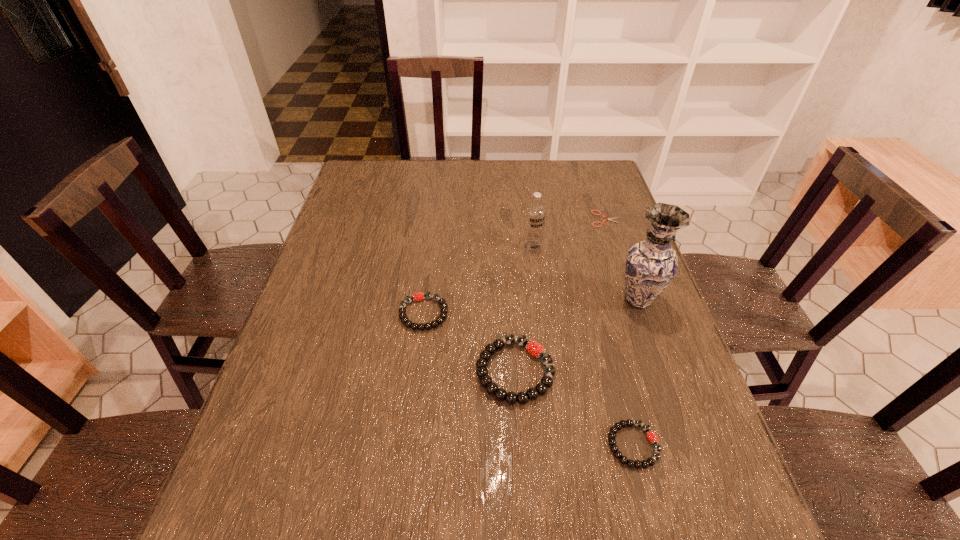
I want to click on the fourth closest object to the second bracelet from right to left, so click(535, 213).

The width and height of the screenshot is (960, 540). I want to click on bracelet that is the closest to the leftmost object, so click(534, 348).

You are a GUI agent. You are given a task and a screenshot of the screen. Output one action in this format:
    pyautogui.click(x=<x>, y=<y>)
    Task: Click on the second closest bracelet to the leftmost bracelet
    This screenshot has height=540, width=960.
    Given the screenshot: What is the action you would take?
    pyautogui.click(x=652, y=437)

Identify the location of free space in the image that satisfies the following two spatial constraints: 1. on the back side of the farthest object; 2. on the left side of the leftmost bracelet. (435, 219).

Where is `free location that satisfies the following two spatial constraints: 1. on the back side of the shortest object; 2. on the right side of the leftmost bracelet`? The width and height of the screenshot is (960, 540). free location that satisfies the following two spatial constraints: 1. on the back side of the shortest object; 2. on the right side of the leftmost bracelet is located at coordinates (435, 219).

The height and width of the screenshot is (540, 960). I want to click on free space that satisfies the following two spatial constraints: 1. on the back side of the vase; 2. on the right side of the second shortest bracelet, so click(425, 300).

You are a GUI agent. You are given a task and a screenshot of the screen. Output one action in this format:
    pyautogui.click(x=<x>, y=<y>)
    Task: Click on the free spot that satisfies the following two spatial constraints: 1. on the front side of the tallest object; 2. on the left side of the shears
    The image size is (960, 540).
    Given the screenshot: What is the action you would take?
    pyautogui.click(x=634, y=300)